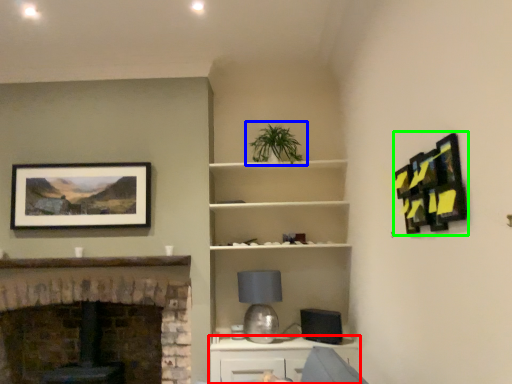
Question: Which object is positioned closest to cabinetry (highlighted by a red box)? Select from houseplant (highlighted by a blue box) and picture frame (highlighted by a green box).

Choices:
 (A) houseplant
 (B) picture frame

Answer: (A)